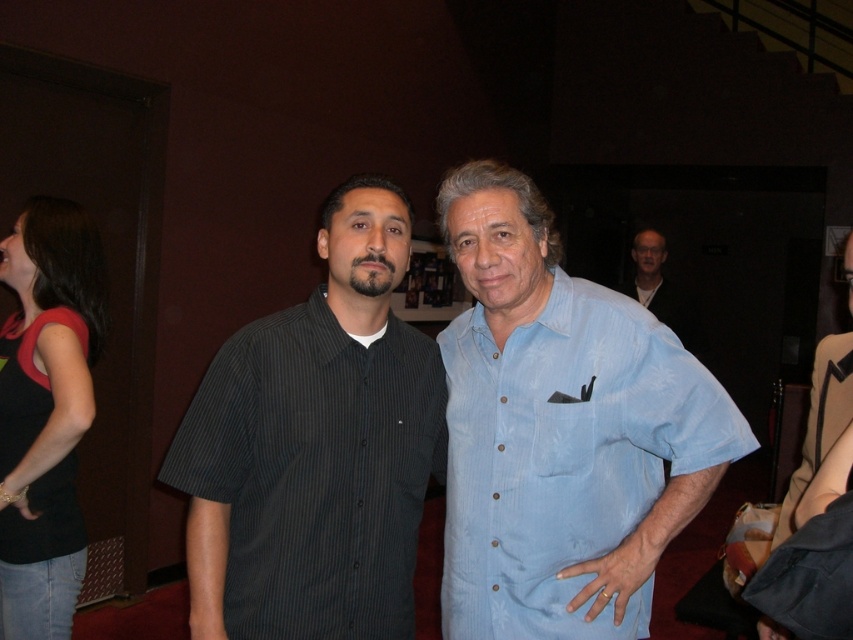
This screenshot has width=853, height=640. Describe the element at coordinates (45, 412) in the screenshot. I see `black fabric top at left` at that location.

Between black fabric top at left and matte blue shirt at upper right, which one is positioned higher?

Positioned higher is matte blue shirt at upper right.

This screenshot has width=853, height=640. What do you see at coordinates (45, 412) in the screenshot? I see `black fabric top at left` at bounding box center [45, 412].

You are a GUI agent. You are given a task and a screenshot of the screen. Output one action in this format:
    pyautogui.click(x=<x>, y=<y>)
    Task: Click on the black fabric top at left
    Image resolution: width=853 pixels, height=640 pixels.
    Given the screenshot: What is the action you would take?
    pyautogui.click(x=45, y=412)

Does dark gray striped shirt at center have a lesser height compared to black fabric top at left?

Yes.

Between dark gray striped shirt at center and black fabric top at left, which one is positioned lower?

black fabric top at left is below.

The height and width of the screenshot is (640, 853). Describe the element at coordinates (316, 448) in the screenshot. I see `dark gray striped shirt at center` at that location.

Where is `dark gray striped shirt at center`? The height and width of the screenshot is (640, 853). dark gray striped shirt at center is located at coordinates (316, 448).

Is light blue cotton shirt at center positioned behind black fabric top at left?

No, it is in front of black fabric top at left.

Between light blue cotton shirt at center and black fabric top at left, which one is positioned lower?

black fabric top at left

Between point (509, 522) and point (32, 582), which one is positioned behind?

The point (32, 582) is more distant.

Find the location of `light blue cotton shirt at center`. light blue cotton shirt at center is located at coordinates (561, 429).